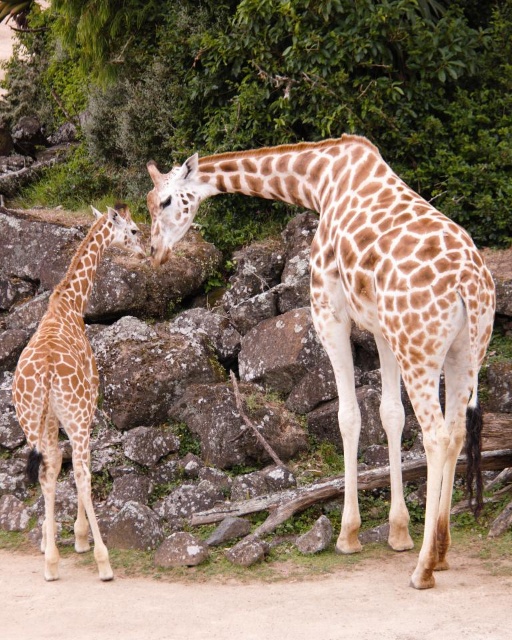
I want to click on green leafy tree at upper center, so (323, 83).

Does green leafy tree at upper center come in front of brown spotted giraffe at center?

That is False.

Describe the element at coordinates (323, 83) in the screenshot. I see `green leafy tree at upper center` at that location.

Identify the location of green leafy tree at upper center. Image resolution: width=512 pixels, height=640 pixels. click(323, 83).

Who is taller, green leafy tree at upper center or brown spotted giraffe at left?

green leafy tree at upper center

Between point (306, 45) and point (100, 556), which one is positioned behind?

Positioned behind is point (306, 45).

Identify the location of green leafy tree at upper center. This screenshot has height=640, width=512. (323, 83).

Can you confirm if brown spotted giraffe at center is bigger than brown spotted giraffe at left?

Correct, brown spotted giraffe at center is larger in size than brown spotted giraffe at left.

Who is more forward, (415, 307) or (73, 467)?

Point (415, 307) is more forward.

The image size is (512, 640). In order to click on brown spotted giraffe at center in this screenshot , I will do `click(370, 307)`.